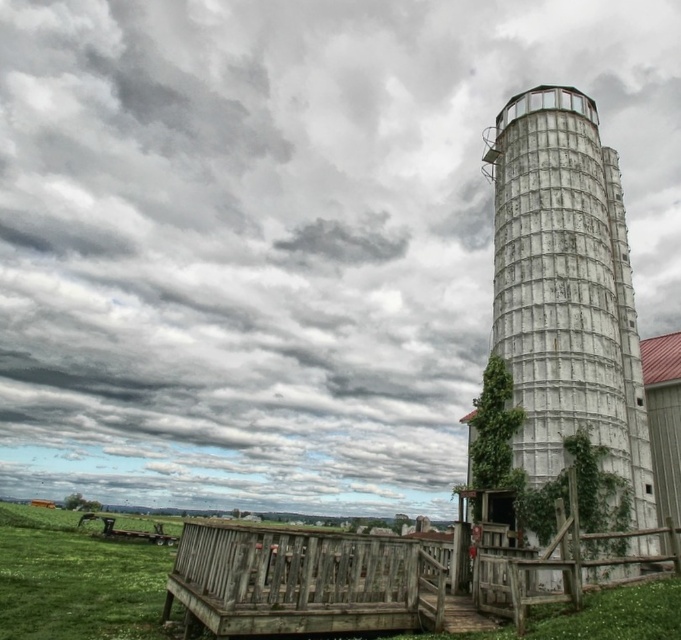
Who is more distant from viewer, (622, 358) or (424, 576)?

The point (622, 358) is behind.

Which of these two, white weathered metal silo at right or weathered wood fence at lower center, stands taller?

weathered wood fence at lower center is taller.

At what (x,y) coordinates should I click in order to perform the action: click on white weathered metal silo at right. Please return your answer as a coordinate pair (x, y). This screenshot has height=640, width=681. Looking at the image, I should click on (567, 291).